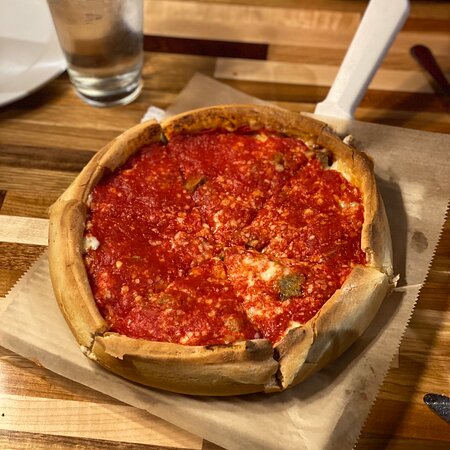
The image size is (450, 450). I want to click on table, so click(x=281, y=40).